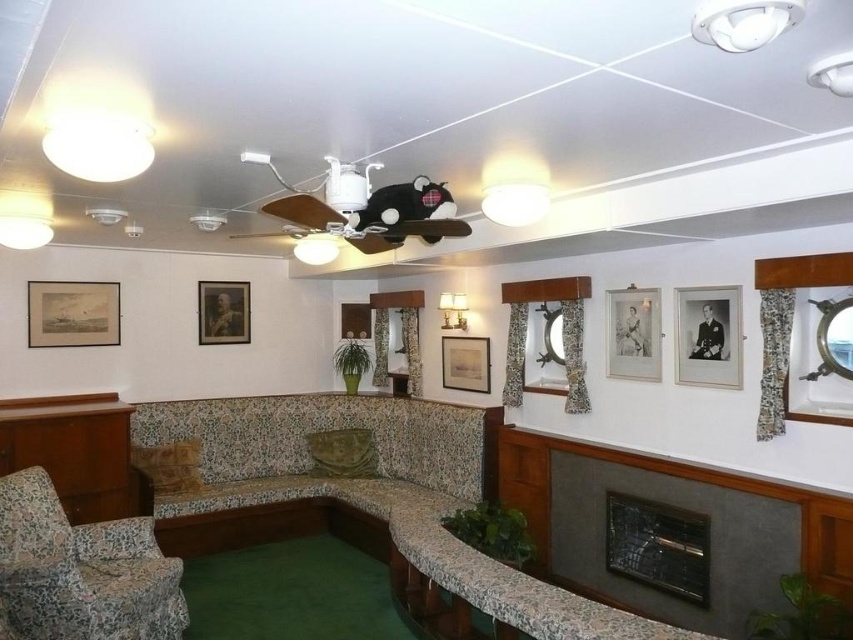
Question: Is floral fabric couch at center above matte wooden picture frame at center?

Choices:
 (A) no
 (B) yes

Answer: (A)

Question: Estimate the real-world distances between objects in this image. Which object is closer to the matte wooden picture frame at center?

Choices:
 (A) matte gold picture frame at upper left
 (B) silver metallic picture frame at center-right

Answer: (B)

Question: Is dark gray stone fireplace at lower right above matte gold picture frame at upper left?

Choices:
 (A) no
 (B) yes

Answer: (A)

Question: Can you confirm if floral fabric couch at center is positioned above silver metallic picture frame at center-right?

Choices:
 (A) yes
 (B) no

Answer: (B)

Question: Which point appears closest to the camera in this image?

Choices:
 (A) (476, 385)
 (B) (28, 518)
 (C) (618, 342)

Answer: (B)

Question: Which of the following is the closest to the observer?

Choices:
 (A) matte wooden picture frame at center
 (B) wooden table at lower left
 (C) silver metallic picture frame at center-right

Answer: (C)